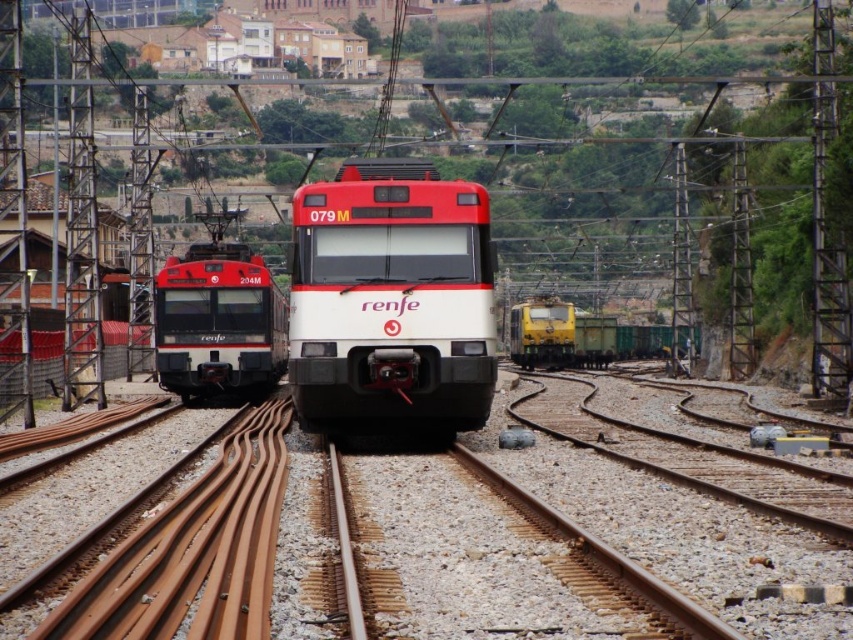
Which is behind, point (485, 317) or point (175, 381)?

Point (175, 381)

Is white glossy train at center in front of matte black train at left?

Yes, it is.

Is point (289, 381) positioned before point (252, 332)?

That is True.

The width and height of the screenshot is (853, 640). What are the coordinates of `white glossy train at center` in the screenshot? It's located at (392, 298).

Is white glossy train at center smaller than yellow matte train at right?

Yes.

Between point (488, 385) and point (606, 355), which one is positioned behind?

Positioned behind is point (606, 355).

This screenshot has width=853, height=640. Find the location of `white glossy train at center`. white glossy train at center is located at coordinates (392, 298).

Who is taller, matte black train at left or yellow matte train at right?

yellow matte train at right

Which is in front, point (236, 275) or point (584, 349)?

Point (236, 275) is in front.

Between point (260, 269) and point (653, 328), which one is positioned behind?

Positioned behind is point (653, 328).

Locate an element on the screen. The width and height of the screenshot is (853, 640). matte black train at left is located at coordinates (218, 323).